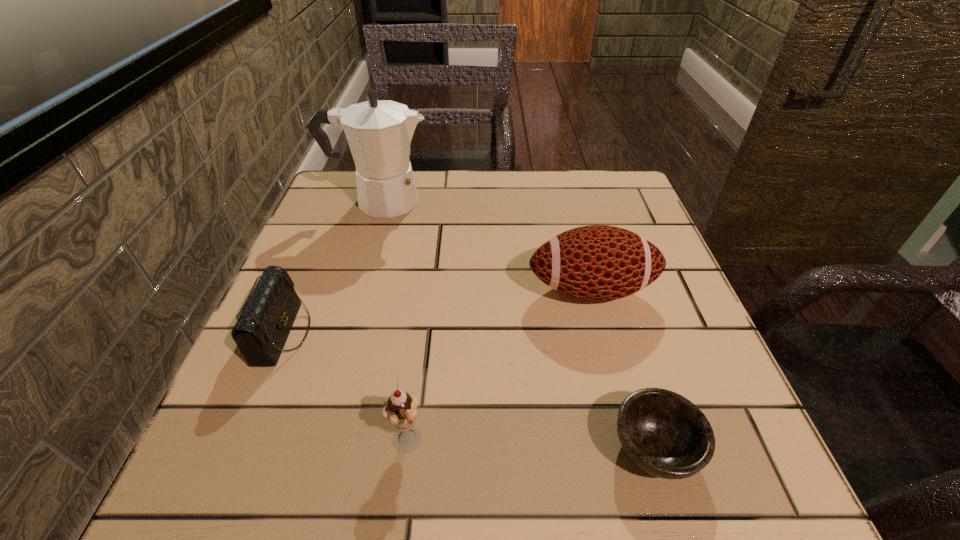
You are a GUI agent. You are given a task and a screenshot of the screen. Output one action in this format:
    pyautogui.click(x=<x>, y=<y>)
    Task: Click on the coffeepot
    
    Given the screenshot: What is the action you would take?
    pyautogui.click(x=379, y=132)

Find the location of `the tallest object`. the tallest object is located at coordinates (379, 132).

This screenshot has height=540, width=960. I want to click on football, so click(x=598, y=262).

Locate an element on the screen. icecream is located at coordinates (401, 409).

Find the location of a particular element. The height and width of the screenshot is (540, 960). the fourth tallest object is located at coordinates (266, 318).

The height and width of the screenshot is (540, 960). Find the location of `bowl`. bowl is located at coordinates (665, 434).

I want to click on free region located 0.090m at the spout of the farthest object, so click(x=468, y=201).

This screenshot has height=540, width=960. I want to click on vacant position located on the back of the football, so click(562, 176).

Locate an element on the screen. This screenshot has width=960, height=540. vacant space situated on the back of the icecream is located at coordinates (430, 261).

Where is `vacant area situated 0.080m on the front flap of the fourth tallest object`? vacant area situated 0.080m on the front flap of the fourth tallest object is located at coordinates (354, 333).